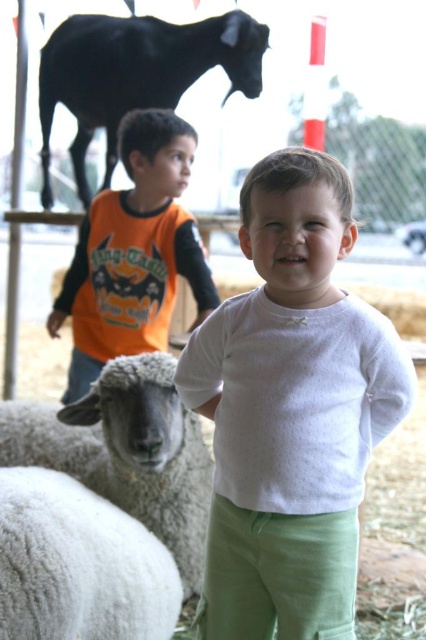
Question: Among these points, which one is nearest to the camera?

Choices:
 (A) (106, 221)
 (B) (334, 308)

Answer: (B)

Question: From the image, what is the correct spatial relationship of white soft shirt at center in relation to white fluffy wool at lower left?

Choices:
 (A) right
 (B) left

Answer: (A)

Question: Which point is farther to the camera?

Choices:
 (A) orange long-sleeved shirt at left
 (B) shiny black goat at upper left
 (C) white woolly sheep at lower left
 (D) white soft shirt at center

Answer: (B)

Question: Is orange long-sleeved shirt at left above white fluffy wool at lower left?

Choices:
 (A) yes
 (B) no

Answer: (A)

Question: Which point is closer to the camera taking this photo?

Choices:
 (A) (163, 563)
 (B) (72, 36)

Answer: (A)

Question: Is white soft shirt at center to the right of white fluffy wool at lower left from the viewer's perspective?

Choices:
 (A) no
 (B) yes

Answer: (B)